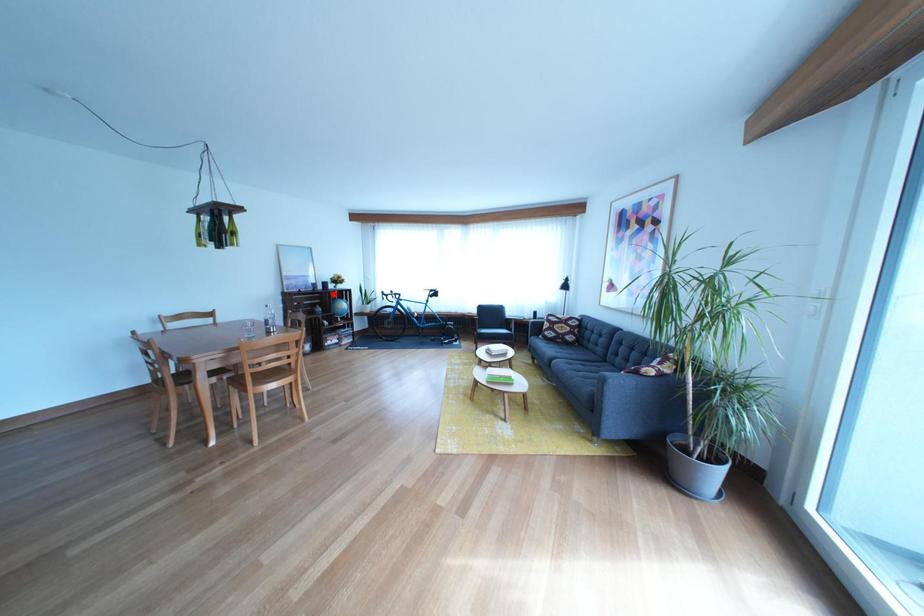
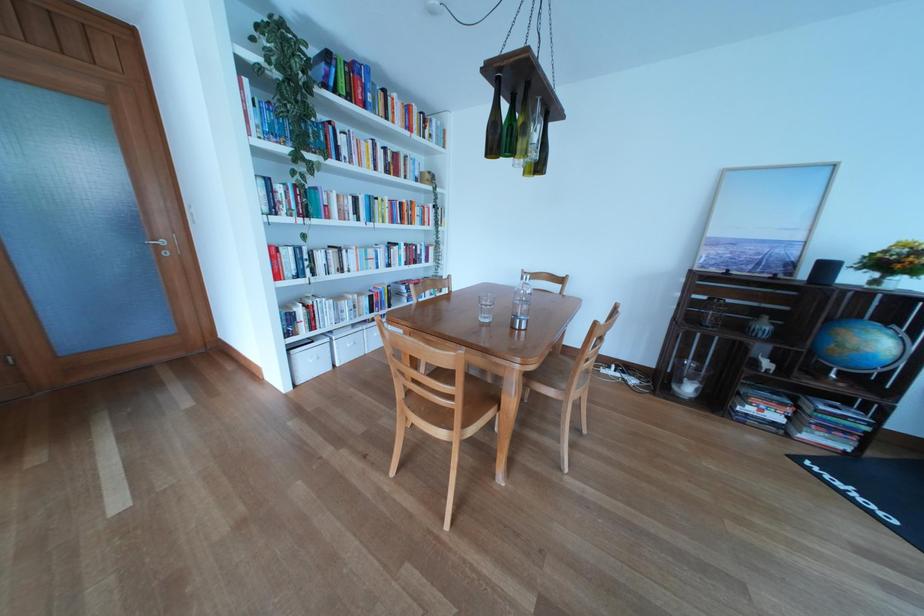
Question: I am providing you with two images of the same scene from different viewpoints. A red point is shown in image1. For the corresponding object point in image2, is it positioned nearer or farther from the camera?

Choices:
 (A) Nearer
 (B) Farther

Answer: (B)